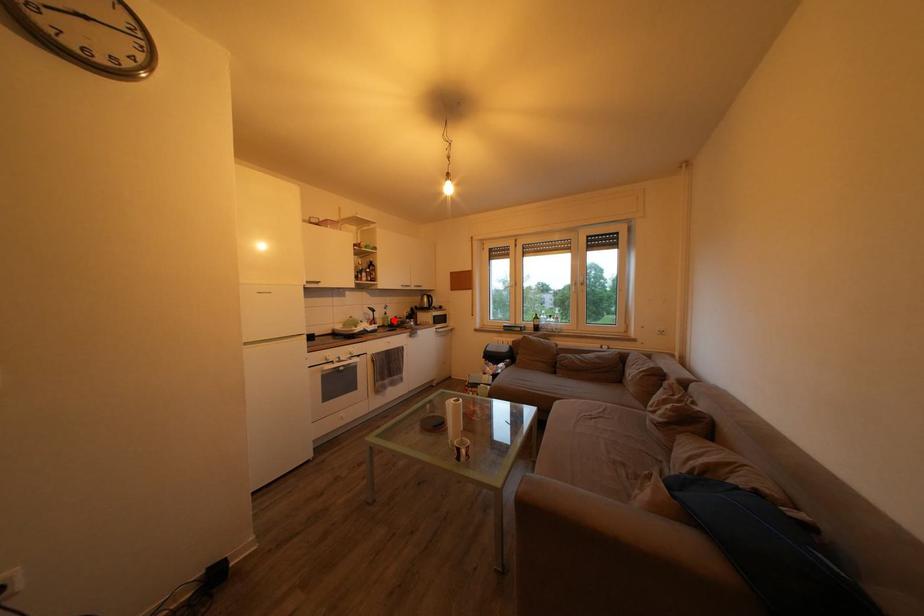
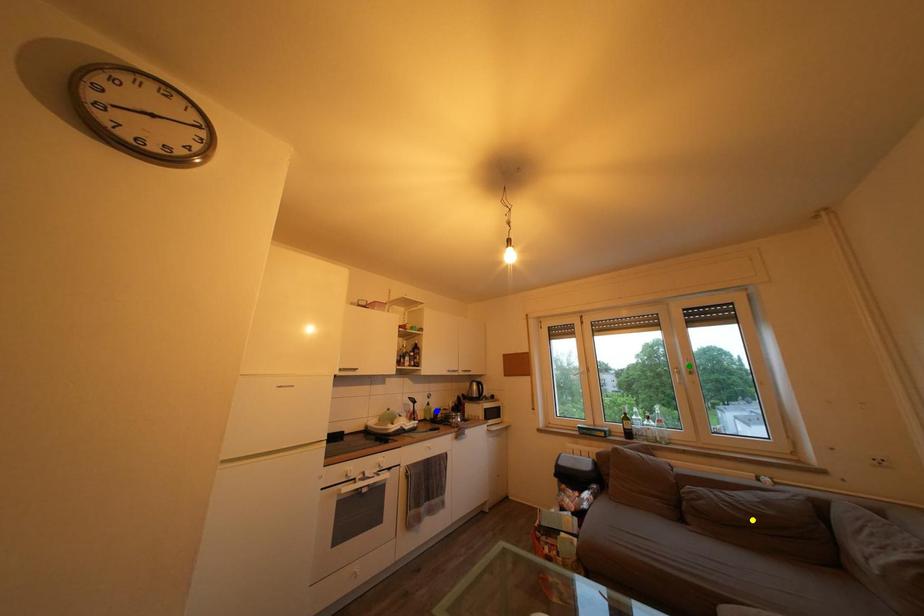
Question: I am providing you with two images of the same scene from different viewpoints. A red point is marked on the first image. You are given multiple points on the second image. Which spot in image 2 lines up with the point in image 1?

Choices:
 (A) green point
 (B) blue point
 (C) yellow point

Answer: (B)